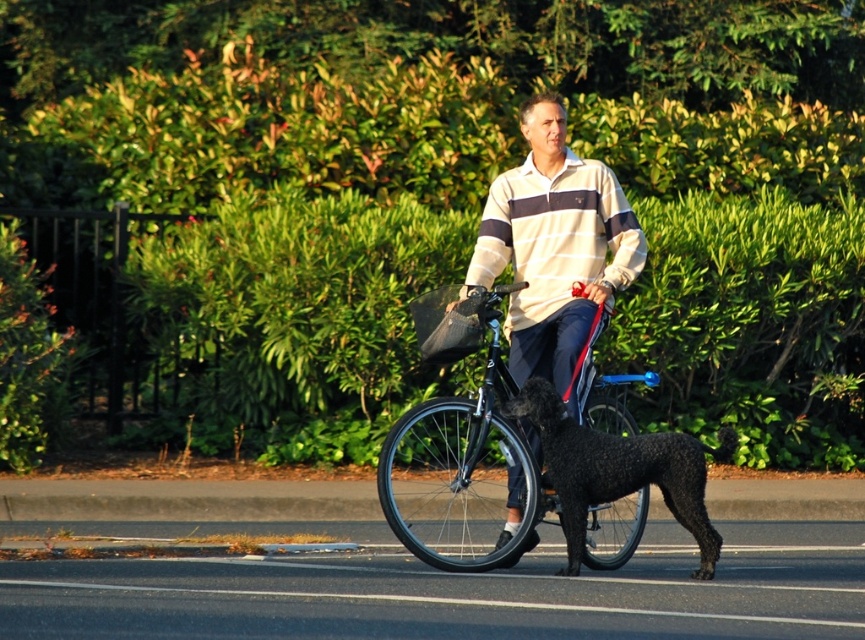
Question: In this image, where is shiny black bicycle at center located relative to black fuzzy dog at center?

Choices:
 (A) left
 (B) right

Answer: (A)

Question: Which is farther from the black fuzzy dog at center?

Choices:
 (A) shiny black bicycle at center
 (B) striped cotton shirt at center

Answer: (B)

Question: Which of the following is the farthest from the observer?

Choices:
 (A) (484, 275)
 (B) (497, 499)

Answer: (B)

Question: Which point is closer to the camera taking this photo?

Choices:
 (A) (396, 490)
 (B) (571, 518)

Answer: (B)

Question: Does striped cotton shirt at center come in front of black fuzzy dog at center?

Choices:
 (A) no
 (B) yes

Answer: (A)

Question: Is striped cotton shirt at center to the right of black fuzzy dog at center from the viewer's perspective?

Choices:
 (A) yes
 (B) no

Answer: (B)